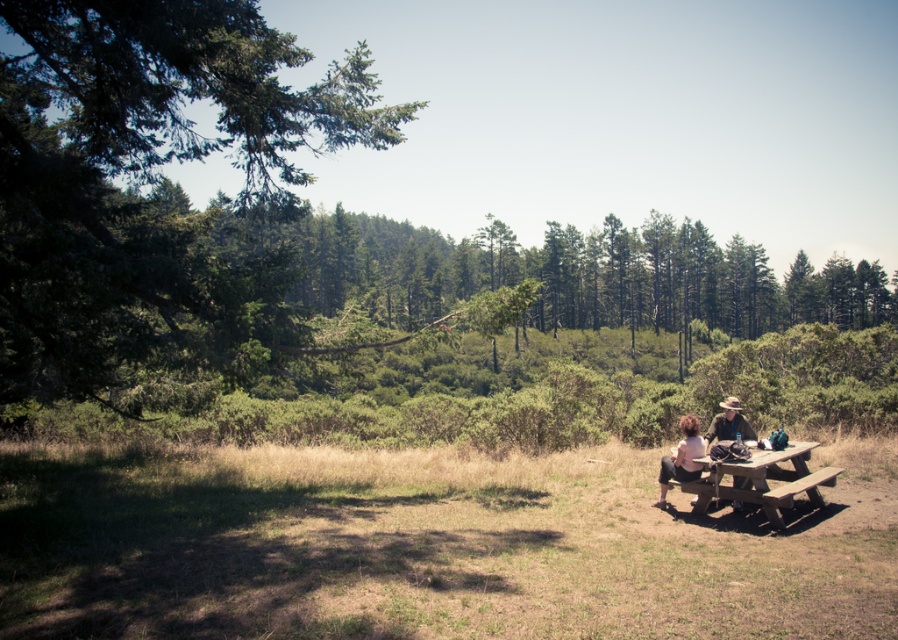
Question: Observing the image, what is the correct spatial positioning of light brown hair at lower right in reference to brown leather hat at right?

Choices:
 (A) below
 (B) above

Answer: (A)

Question: Is wooden picnic table at lower right below light brown hair at lower right?

Choices:
 (A) yes
 (B) no

Answer: (A)

Question: Which object appears closest to the camera in this image?

Choices:
 (A) brown leather hat at right
 (B) wooden picnic table at lower right
 (C) brown leather hat at center
 (D) light brown hair at lower right

Answer: (B)

Question: Is brown leather hat at center thinner than light brown hair at lower right?

Choices:
 (A) yes
 (B) no

Answer: (A)

Question: Which point is closer to the camera?

Choices:
 (A) (725, 422)
 (B) (771, 492)

Answer: (B)

Question: Which point is closer to the camera taking this photo?

Choices:
 (A) (753, 433)
 (B) (659, 470)
 (C) (668, 467)
 (D) (715, 488)

Answer: (D)